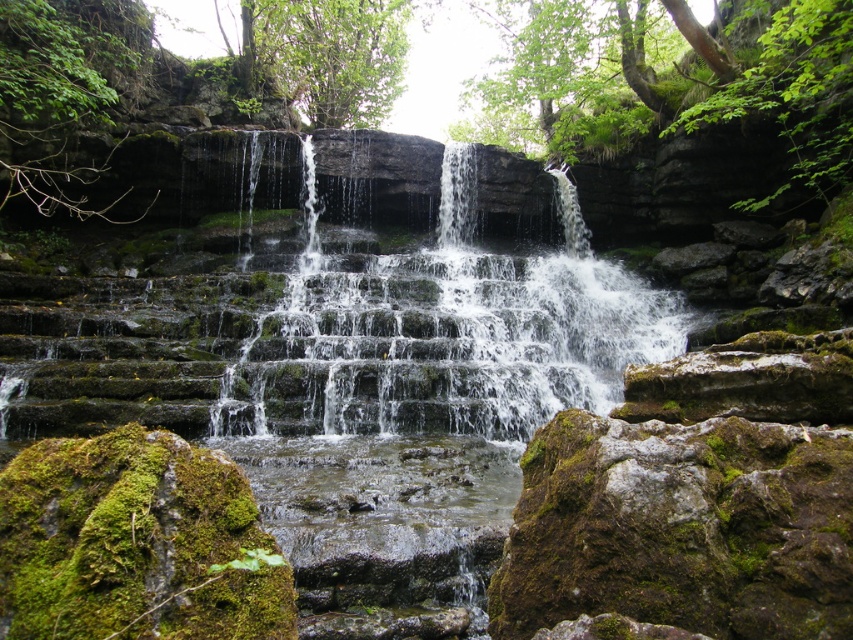
Which of these two, green mossy rocks at center or green mossy rock at center, stands taller?

green mossy rocks at center is taller.

Is point (758, 189) in front of point (462, 250)?

Yes, point (758, 189) is closer to viewer.

You are a GUI agent. You are given a task and a screenshot of the screen. Output one action in this format:
    pyautogui.click(x=<x>, y=<y>)
    Task: Click on the green mossy rocks at center
    
    Given the screenshot: What is the action you would take?
    pyautogui.click(x=698, y=109)

Is green mossy rocks at center above clear water at center?

Yes, green mossy rocks at center is above clear water at center.

Does green mossy rocks at center have a lesser width compared to clear water at center?

Incorrect, green mossy rocks at center's width is not less than clear water at center's.

You are a GUI agent. You are given a task and a screenshot of the screen. Output one action in this format:
    pyautogui.click(x=<x>, y=<y>)
    Task: Click on the green mossy rocks at center
    
    Given the screenshot: What is the action you would take?
    pyautogui.click(x=698, y=109)

Find the location of a particular element. The image size is (853, 640). green mossy rocks at center is located at coordinates (698, 109).

Can you confirm if green mossy rock at center is bigger than clear water at center?

Yes, green mossy rock at center is bigger than clear water at center.

Is green mossy rock at center in front of clear water at center?

That is True.

This screenshot has width=853, height=640. What are the coordinates of `green mossy rock at center` in the screenshot? It's located at (439, 339).